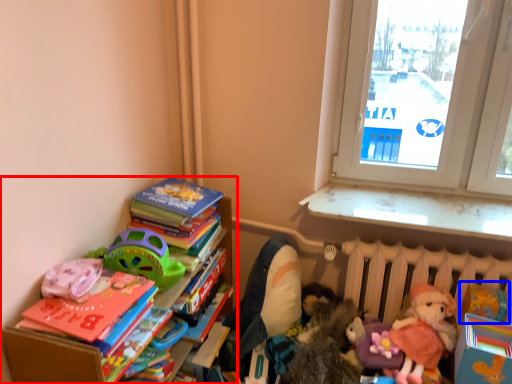
Question: Which object appears farthest to the camera in this image, bookcase (highlighted by a red box) or toy (highlighted by a blue box)?

Choices:
 (A) bookcase
 (B) toy

Answer: (B)